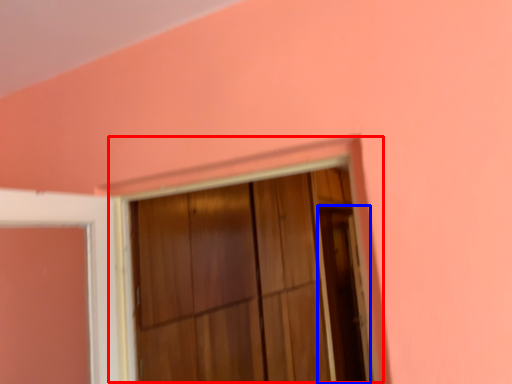
Question: Which object is closer to the camera taking this photo, window frame (highlighted by a red box) or screen door (highlighted by a blue box)?

Choices:
 (A) window frame
 (B) screen door

Answer: (A)